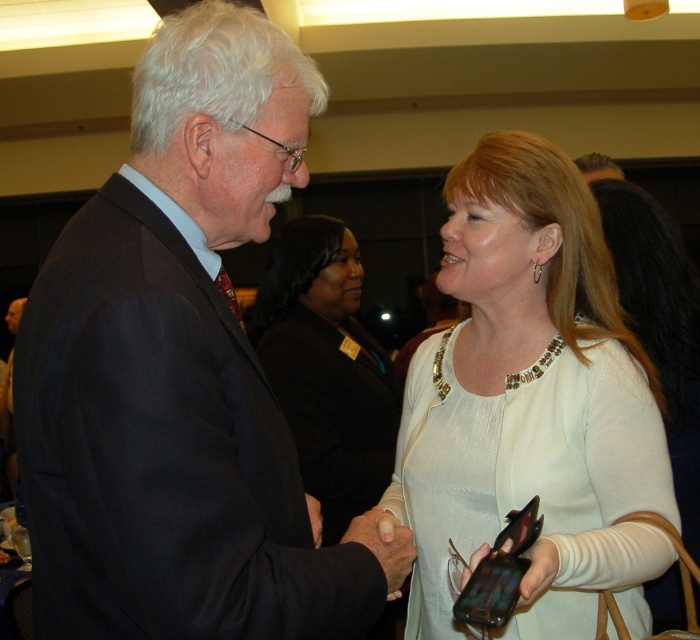
Looking at this image, between white beaded necklace at center and matte black blazer at center, which one is positioned lower?

matte black blazer at center is lower down.

Who is taller, white beaded necklace at center or matte black blazer at center?

With more height is matte black blazer at center.

Does point (442, 406) come closer to viewer compared to point (364, 468)?

That is True.

Locate an element on the screen. The image size is (700, 640). white beaded necklace at center is located at coordinates (531, 404).

In the scene shown: Is dark blue suit at center above white beaded necklace at center?

Yes.

Can you confirm if dark blue suit at center is bigger than white beaded necklace at center?

Actually, dark blue suit at center might be smaller than white beaded necklace at center.

Does point (200, 499) come closer to viewer compared to point (568, 476)?

Yes, it is in front of point (568, 476).

Locate an element on the screen. The height and width of the screenshot is (640, 700). dark blue suit at center is located at coordinates (182, 372).

Does dark blue suit at center have a greater height compared to matte black blazer at center?

No, dark blue suit at center is not taller than matte black blazer at center.

Who is lower down, dark blue suit at center or matte black blazer at center?

matte black blazer at center is lower down.

Does point (130, 557) lie in front of point (360, 483)?

Yes.

I want to click on dark blue suit at center, so click(x=182, y=372).